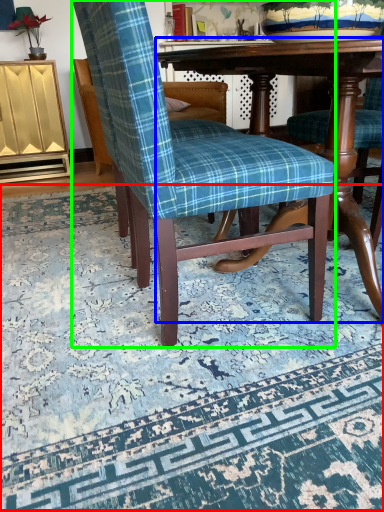
Question: Based on their relative distances, which object is nearer to mat (highlighted by a red box)? Choose from table (highlighted by a blue box) and chair (highlighted by a green box).

Choices:
 (A) table
 (B) chair

Answer: (B)